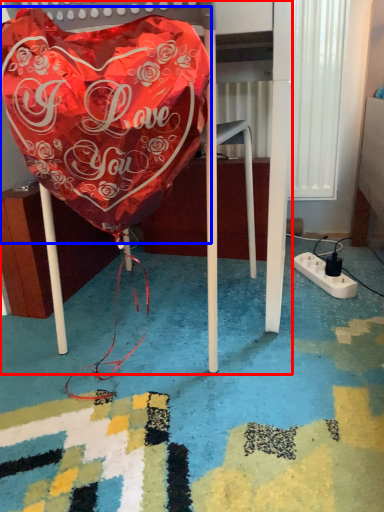
Question: Which object appears farthest to the camera in this image, furniture (highlighted by a red box) or blanket (highlighted by a blue box)?

Choices:
 (A) furniture
 (B) blanket

Answer: (A)